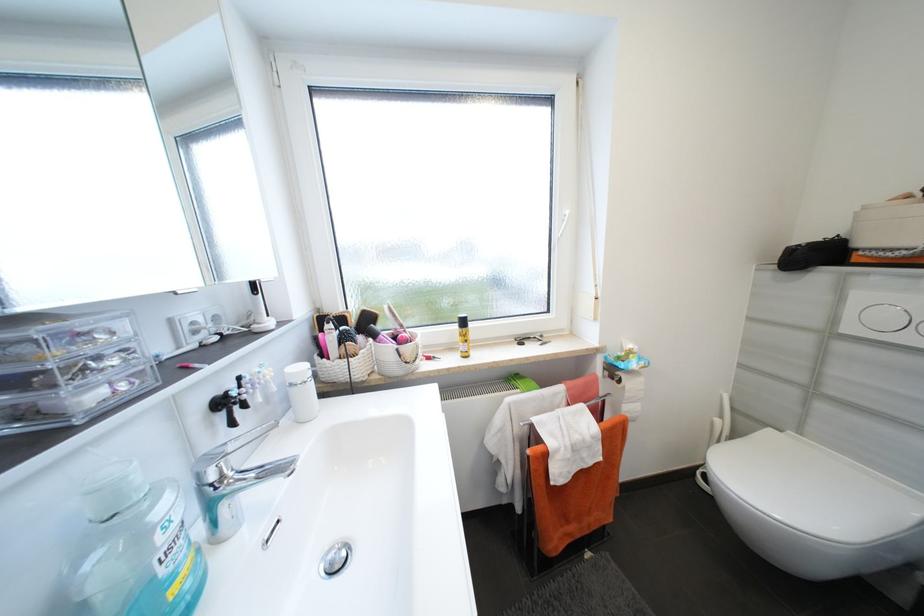
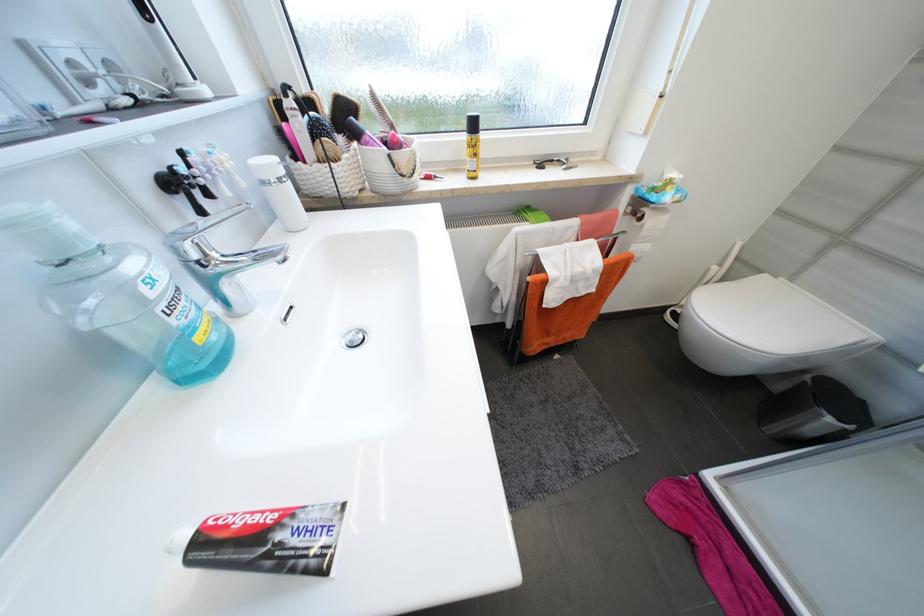
Find the pixel in the second image that matches [226,405] in the first image.

(178, 185)